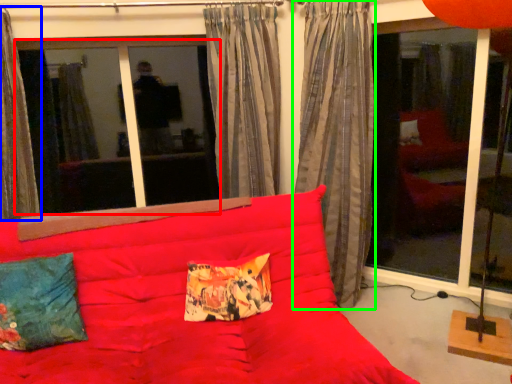
Question: Which object is the farthest from window screen (highlighted by a red box)? Choose among these: curtain (highlighted by a blue box) or curtain (highlighted by a green box).

Choices:
 (A) curtain
 (B) curtain

Answer: (B)